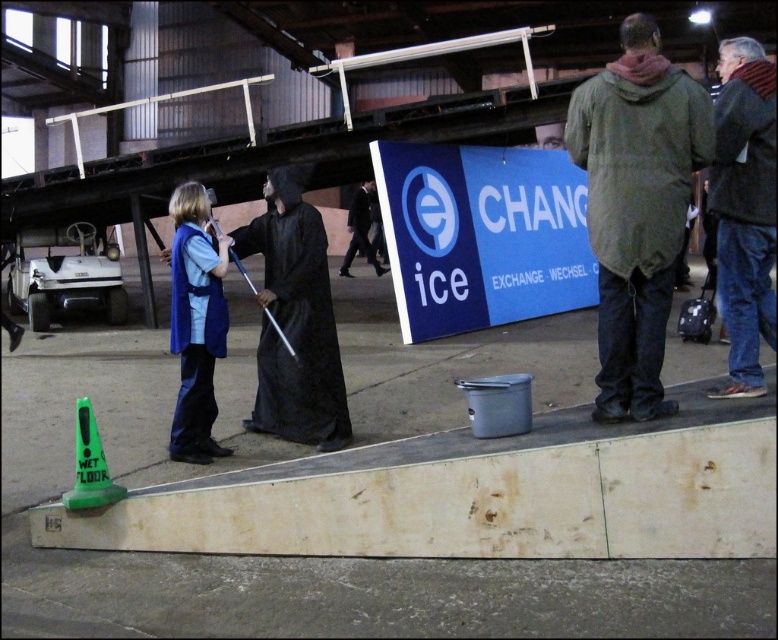
You are an observer standing on the platform. You see the dark blue jeans at right and the green plastic cone at lower left. Which object is closer to you?

The dark blue jeans at right is closer to you because it is in front of the green plastic cone at lower left.

You are an event planner setting up a photo shoot in this industrial space. You need to ensure that all participants are visible in the frame. Given the dark blue jeans at right and the dark suit at center, which of these two items is shorter in height?

The dark blue jeans at right is shorter than the dark suit at center, so the dark blue jeans at right would be less visible if they are shorter in height compared to the dark suit at center.

You are an event organizer checking the safety of the venue. You notice the dark blue jeans at right and the green plastic cone at lower left. Which object is bigger in size?

The dark blue jeans at right has a larger size compared to the green plastic cone at lower left, so the dark blue jeans at right is bigger.